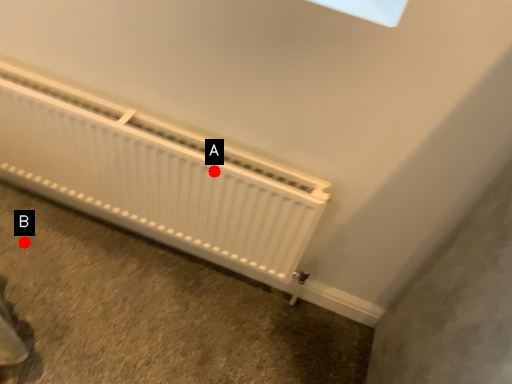
Question: Two points are circled on the image, labeled by A and B beside each circle. Which point is closer to the camera?

Choices:
 (A) A is closer
 (B) B is closer

Answer: (A)